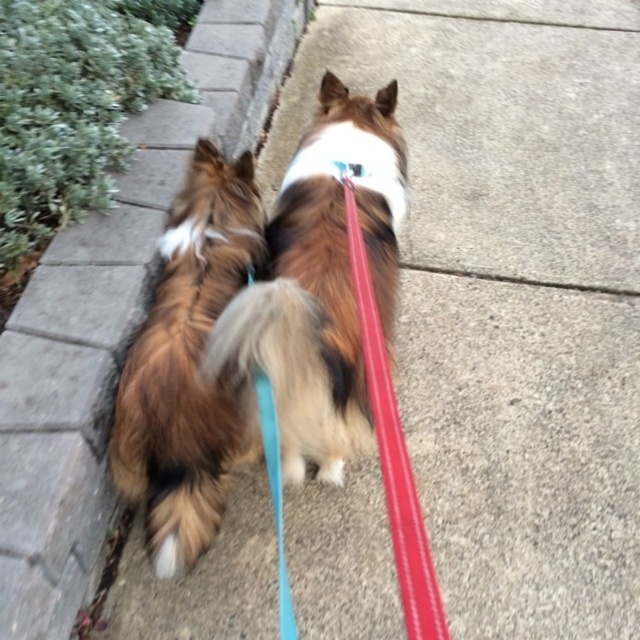
Can you confirm if concrete at upper left is positioned above blue fabric collar at upper center?

Yes.

Between concrete at upper left and blue fabric collar at upper center, which one is positioned lower?

blue fabric collar at upper center is lower down.

Locate an element on the screen. concrete at upper left is located at coordinates (109, 317).

I want to click on concrete at upper left, so click(109, 317).

Is the position of brown fluffy dog at center less distant than that of blue fabric collar at upper center?

Yes, it is.

Is point (342, 97) more distant than point (349, 166)?

Yes, point (342, 97) is farther from viewer.

The height and width of the screenshot is (640, 640). What do you see at coordinates (321, 284) in the screenshot? I see `brown fluffy dog at center` at bounding box center [321, 284].

Where is `brown fluffy dog at center`? brown fluffy dog at center is located at coordinates (321, 284).

Which is more to the right, concrete at upper left or brown fluffy dog at center?

brown fluffy dog at center is more to the right.

Does concrete at upper left come in front of brown fluffy dog at center?

No.

Does point (60, 593) come closer to viewer compared to point (305, 387)?

No, (60, 593) is further to viewer.

Where is `concrete at upper left`? This screenshot has width=640, height=640. concrete at upper left is located at coordinates (109, 317).